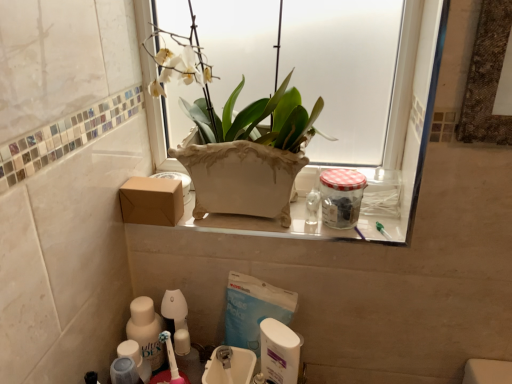
Question: In terms of width, does white plastic container at lower center, positioned as the second cleaning product in left-to-right order, look wider or thinner when compared to white glossy ceramic vase at upper center?

Choices:
 (A) thin
 (B) wide

Answer: (A)

Question: Is white plastic container at lower center, the first cleaning product from the right, to the left or to the right of white glossy ceramic vase at upper center in the image?

Choices:
 (A) right
 (B) left

Answer: (A)

Question: Which of these objects is positioned farthest from the white glossy ceramic vase at upper center?

Choices:
 (A) white plastic container at lower center, positioned as the second cleaning product in left-to-right order
 (B) clear glass jar at upper right
 (C) brown cardboard box at lower left
 (D) white glossy sink at lower center, which is counted as the second sink, starting from the back
 (E) white plastic sink at lower center, which ranks as the 2th sink in front-to-back order

Answer: (D)

Question: Which of these objects is positioned farthest from the translucent plastic bottle at lower left, the 2th cleaning product positioned from the right?

Choices:
 (A) clear glass jar at upper right
 (B) white plastic container at lower center, positioned as the second cleaning product in left-to-right order
 (C) brown cardboard box at lower left
 (D) white glossy sink at lower center, which is counted as the second sink, starting from the back
 (E) white plastic sink at lower center, which is the first sink from back to front

Answer: (A)